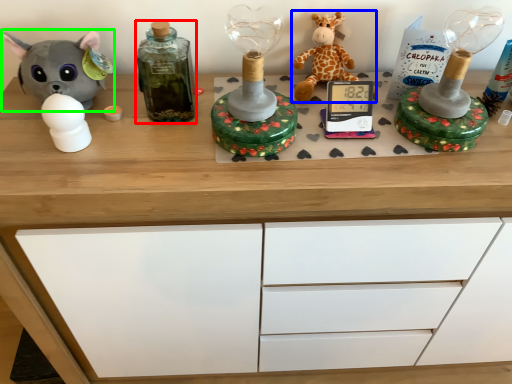
Question: Considering the real-world distances, which object is farthest from bottle (highlighted by a red box)? toy (highlighted by a blue box) or toy (highlighted by a green box)?

Choices:
 (A) toy
 (B) toy

Answer: (A)